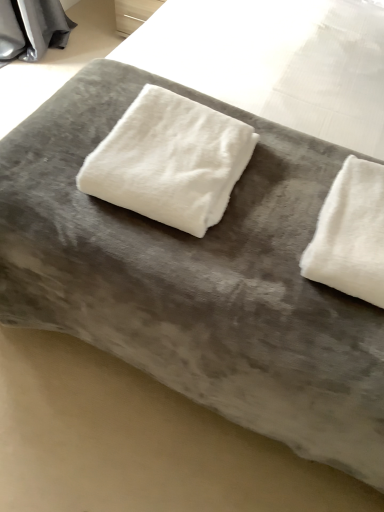
Question: From a real-world perspective, is white fluffy towel at right, the first towel viewed from the right, physically below white fluffy towel at center, marked as the 2th towel in a right-to-left arrangement?

Choices:
 (A) yes
 (B) no

Answer: (A)

Question: Does white fluffy towel at right, the second towel from the left, have a smaller size compared to white fluffy towel at center, placed as the first towel when sorted from left to right?

Choices:
 (A) no
 (B) yes

Answer: (B)

Question: Considering the relative positions of white fluffy towel at right, the second towel from the left, and white fluffy towel at center, placed as the first towel when sorted from left to right, in the image provided, is white fluffy towel at right, the second towel from the left, to the right of white fluffy towel at center, placed as the first towel when sorted from left to right, from the viewer's perspective?

Choices:
 (A) yes
 (B) no

Answer: (A)

Question: Does white fluffy towel at right, the second towel from the left, have a greater width compared to white fluffy towel at center, placed as the first towel when sorted from left to right?

Choices:
 (A) yes
 (B) no

Answer: (B)

Question: Is the position of white fluffy towel at right, the first towel viewed from the right, more distant than that of white fluffy towel at center, marked as the 2th towel in a right-to-left arrangement?

Choices:
 (A) no
 (B) yes

Answer: (A)

Question: Does white fluffy towel at right, the second towel from the left, have a larger size compared to white fluffy towel at center, placed as the first towel when sorted from left to right?

Choices:
 (A) yes
 (B) no

Answer: (B)

Question: Considering the relative sizes of white fluffy towel at center, marked as the 2th towel in a right-to-left arrangement, and white fluffy towel at right, the first towel viewed from the right, in the image provided, is white fluffy towel at center, marked as the 2th towel in a right-to-left arrangement, bigger than white fluffy towel at right, the first towel viewed from the right,?

Choices:
 (A) yes
 (B) no

Answer: (A)

Question: From a real-world perspective, is white fluffy towel at center, marked as the 2th towel in a right-to-left arrangement, physically above white fluffy towel at right, the second towel from the left?

Choices:
 (A) yes
 (B) no

Answer: (A)

Question: Does white fluffy towel at center, marked as the 2th towel in a right-to-left arrangement, lie in front of white fluffy towel at right, the first towel viewed from the right?

Choices:
 (A) yes
 (B) no

Answer: (B)

Question: Is white fluffy towel at center, placed as the first towel when sorted from left to right, at the left side of white fluffy towel at right, the first towel viewed from the right?

Choices:
 (A) yes
 (B) no

Answer: (A)

Question: Does white fluffy towel at center, placed as the first towel when sorted from left to right, have a greater width compared to white fluffy towel at right, the second towel from the left?

Choices:
 (A) yes
 (B) no

Answer: (A)

Question: From the image's perspective, is white fluffy towel at center, placed as the first towel when sorted from left to right, located above white fluffy towel at right, the second towel from the left?

Choices:
 (A) no
 (B) yes

Answer: (B)

Question: Considering the positions of white fluffy towel at center, placed as the first towel when sorted from left to right, and white fluffy towel at right, the first towel viewed from the right, in the image, is white fluffy towel at center, placed as the first towel when sorted from left to right, taller or shorter than white fluffy towel at right, the first towel viewed from the right,?

Choices:
 (A) short
 (B) tall

Answer: (B)